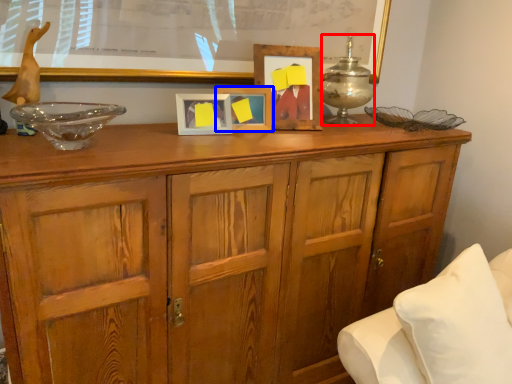
Question: Among these objects, which one is nearest to the camera, candle holder (highlighted by a red box) or picture frame (highlighted by a blue box)?

Choices:
 (A) candle holder
 (B) picture frame

Answer: (B)